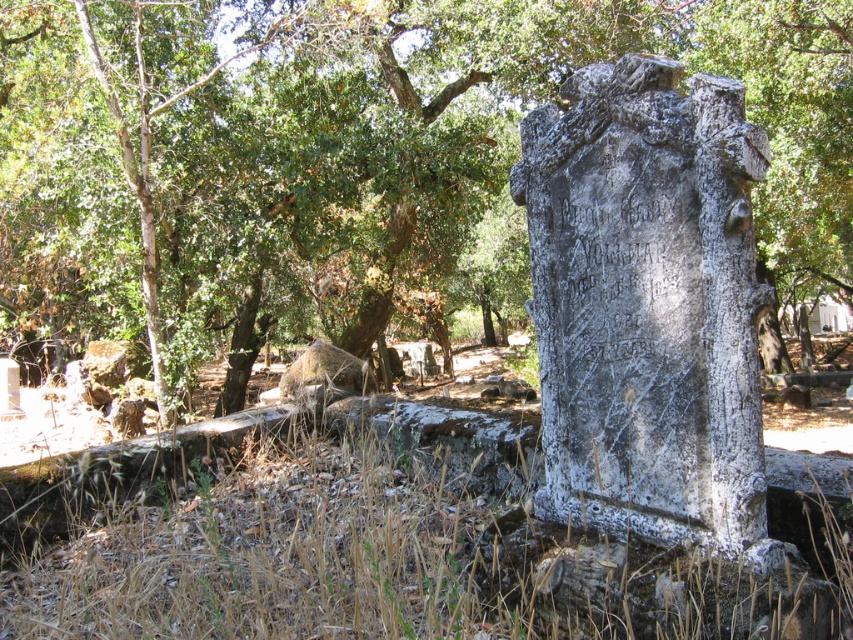
Question: Which point is closer to the camera?

Choices:
 (A) (166, 65)
 (B) (753, 406)
 (C) (244, 582)

Answer: (B)

Question: Where is green leafy tree at center located in relation to dry grass at lower center in the image?

Choices:
 (A) above
 (B) below

Answer: (A)

Question: Estimate the real-world distances between objects in this image. Which object is farther from the dry grass at lower center?

Choices:
 (A) white stone pillar at center
 (B) green leafy tree at center

Answer: (B)

Question: Does green leafy tree at center lie in front of white stone pillar at center?

Choices:
 (A) no
 (B) yes

Answer: (A)

Question: Which object is positioned closest to the white stone pillar at center?

Choices:
 (A) green leafy tree at center
 (B) dry grass at lower center

Answer: (B)

Question: Can you confirm if white stone pillar at center is thinner than dry grass at lower center?

Choices:
 (A) yes
 (B) no

Answer: (A)